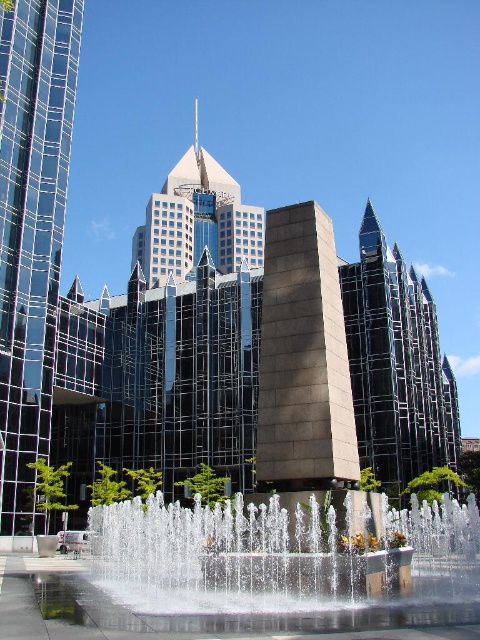
Does shiny glass tower at left appear under glassy steel skyscraper at center?

Indeed, shiny glass tower at left is positioned under glassy steel skyscraper at center.

Who is more distant from viewer, (54, 152) or (192, 147)?

Point (192, 147)

Where is `shiny glass tower at left`? This screenshot has height=640, width=480. shiny glass tower at left is located at coordinates (32, 232).

This screenshot has width=480, height=640. Identify the location of shiny glass tower at left. (32, 232).

Which is more to the left, shiny glass tower at left or slate gray stone tower at center?

shiny glass tower at left

Is shiny glass tower at left to the right of slate gray stone tower at center from the viewer's perspective?

Incorrect, shiny glass tower at left is not on the right side of slate gray stone tower at center.

The width and height of the screenshot is (480, 640). What do you see at coordinates (32, 232) in the screenshot?
I see `shiny glass tower at left` at bounding box center [32, 232].

Identify the location of shiny glass tower at left. (32, 232).

Is point (154, 568) farther from viewer compared to point (33, 384)?

No, it is not.

Does clear glass water at center appear on the right side of shiny glass tower at left?

Indeed, clear glass water at center is positioned on the right side of shiny glass tower at left.

Who is more forward, (109, 513) or (19, 422)?

Point (109, 513)

Where is `clear glass water at center`? clear glass water at center is located at coordinates (285, 561).